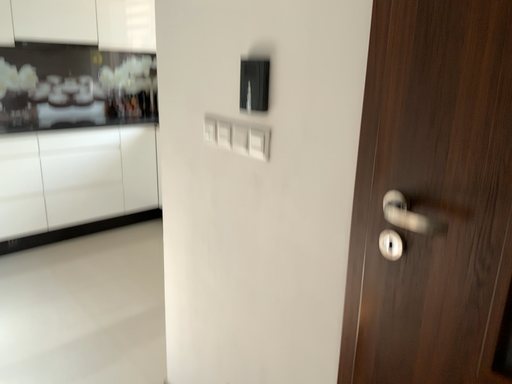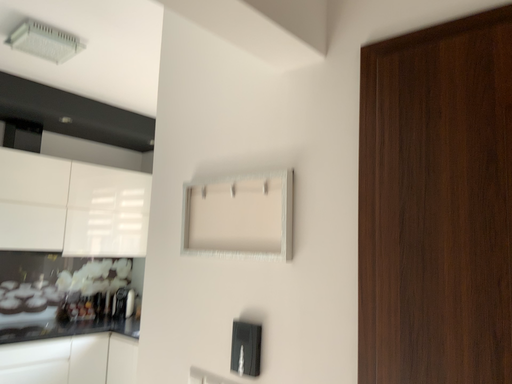
Question: Which way did the camera rotate in the video?

Choices:
 (A) rotated left
 (B) rotated right

Answer: (B)